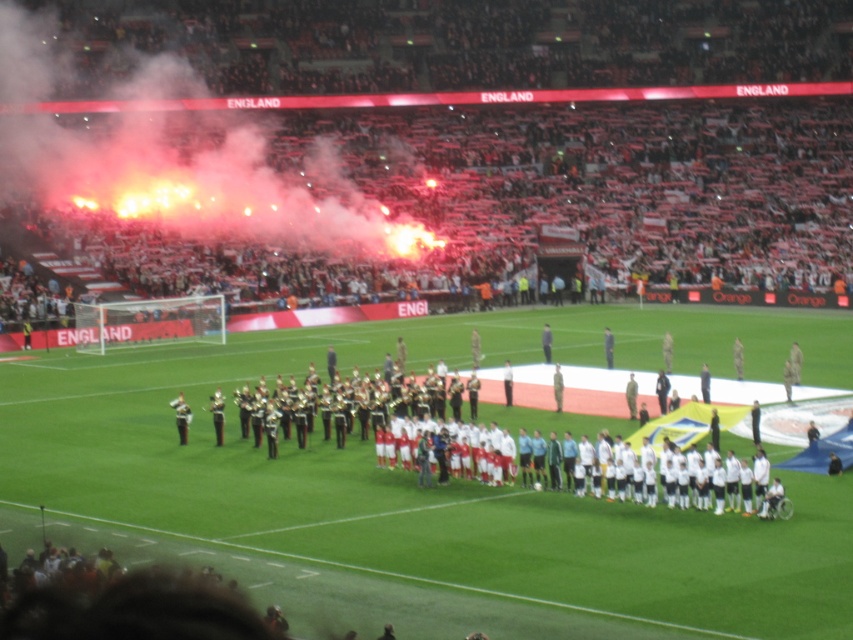
Question: In this image, where is red smoke at upper left located relative to white fabric football team at center?

Choices:
 (A) below
 (B) above

Answer: (B)

Question: Is red smoke at upper left to the left of white fabric football team at center from the viewer's perspective?

Choices:
 (A) no
 (B) yes

Answer: (B)

Question: Is red smoke at upper left below white fabric football team at center?

Choices:
 (A) no
 (B) yes

Answer: (A)

Question: Which point is farther to the camera?

Choices:
 (A) (366, 380)
 (B) (260, 148)

Answer: (B)

Question: Which object is farther from the camera taking this photo?

Choices:
 (A) white fabric football team at center
 (B) red smoke at upper left

Answer: (B)